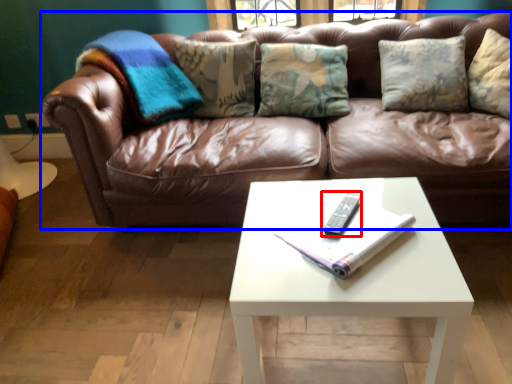
Question: Which object is closer to the camera taking this photo, remote (highlighted by a red box) or studio couch (highlighted by a blue box)?

Choices:
 (A) remote
 (B) studio couch

Answer: (A)